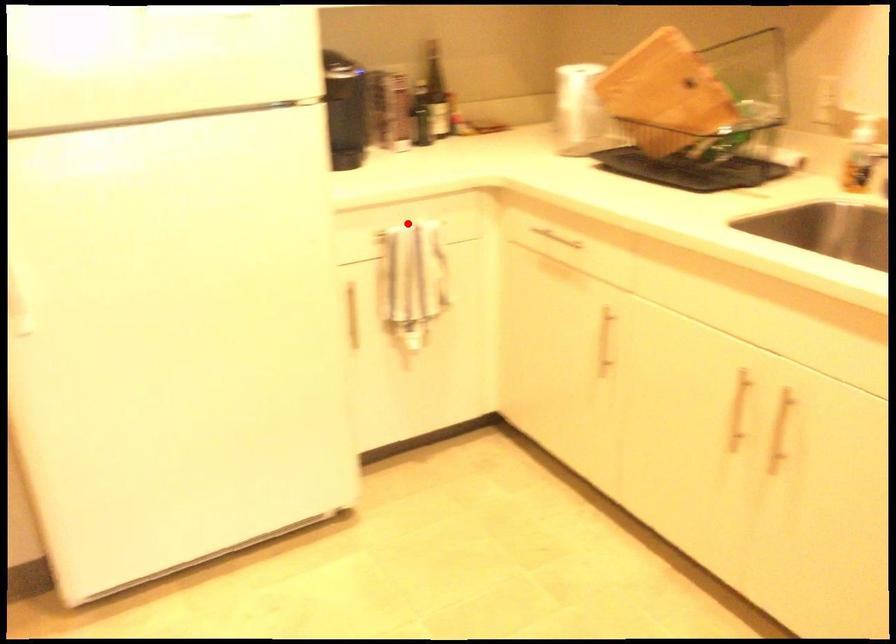
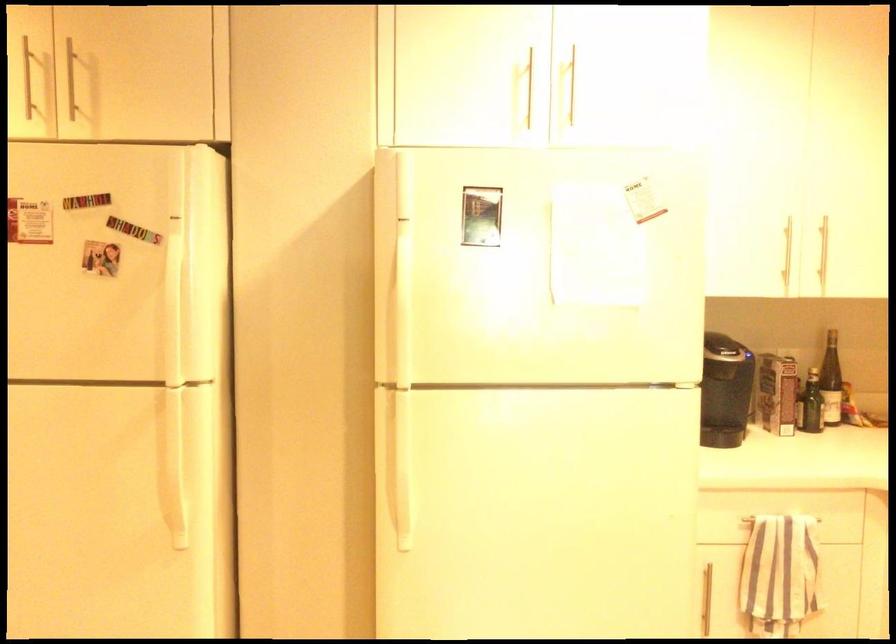
Where in the second image is the point corresponding to the highlighted location from the first image?

(781, 518)